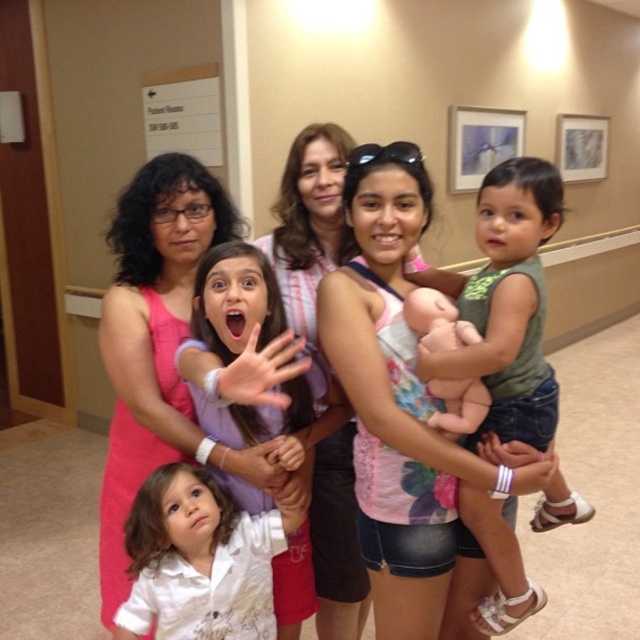
Question: Does pink fabric dress at center appear under green fabric dress at center?

Choices:
 (A) yes
 (B) no

Answer: (B)

Question: Is pink floral tank top at center above pink fabric dress at center?

Choices:
 (A) no
 (B) yes

Answer: (A)

Question: Considering the relative positions of pink fabric dress at center and matte purple shirt at center in the image provided, where is pink fabric dress at center located with respect to matte purple shirt at center?

Choices:
 (A) above
 (B) below

Answer: (A)

Question: Which point is farther to the camera?

Choices:
 (A) soft pink fabric baby at center
 (B) pink fabric dress at center
 (C) pink floral tank top at center

Answer: (B)

Question: Which object is closer to the camera taking this photo?

Choices:
 (A) matte purple shirt at center
 (B) pink striped shirt at center
 (C) soft pink fabric baby at center

Answer: (A)

Question: Which of these objects is positioned closest to the pink floral tank top at center?

Choices:
 (A) green fabric dress at center
 (B) soft pink fabric baby at center
 (C) pink striped shirt at center

Answer: (B)